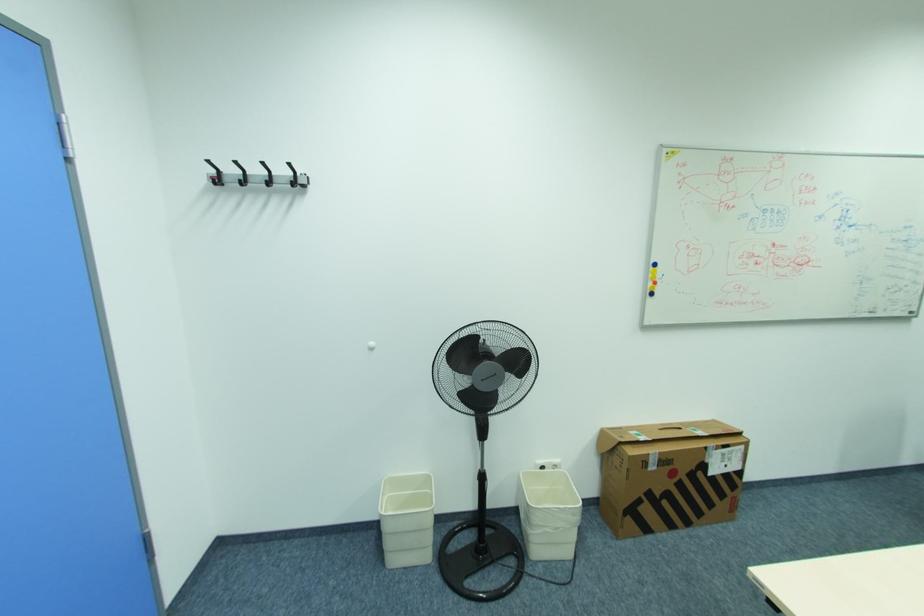
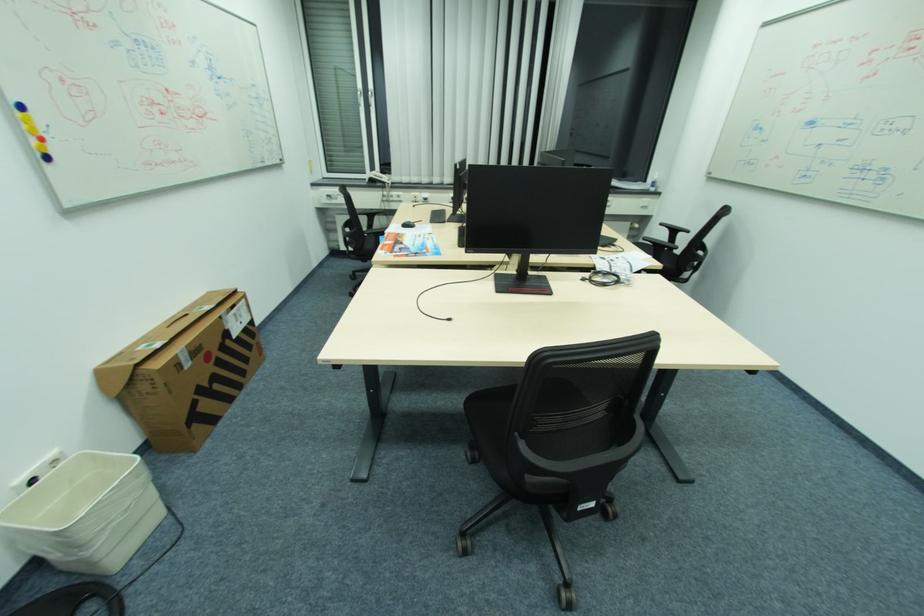
Locate, in the second image, the point that corresponds to point (658, 294) in the first image.

(52, 158)